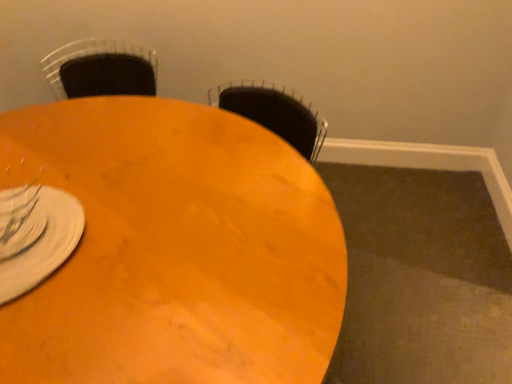
The height and width of the screenshot is (384, 512). Identify the location of free space behind clear glass fork at lower left. (37, 185).